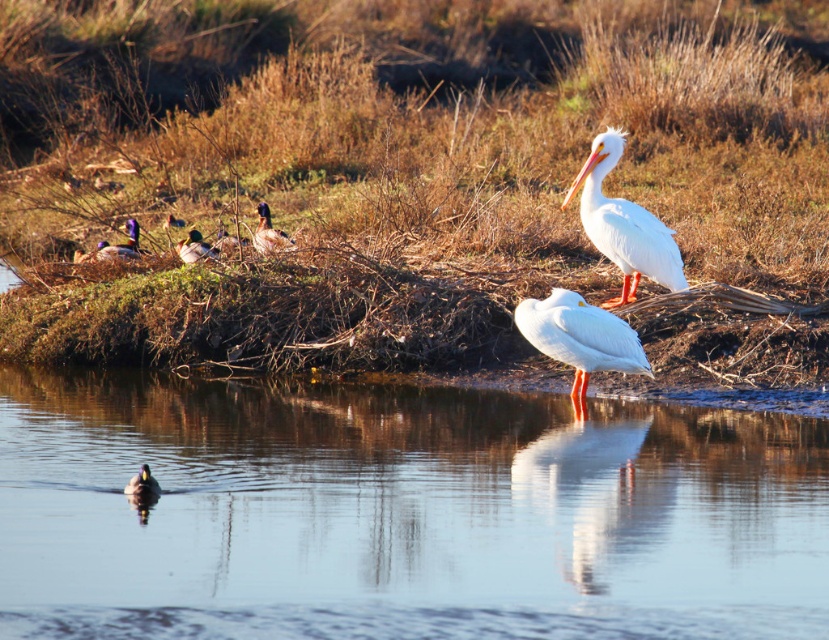
Question: Among these objects, which one is farthest from the camera?

Choices:
 (A) brown speckled duck at upper left
 (B) white smooth pelican at center
 (C) brown speckled feathers at upper left

Answer: (A)

Question: Which object appears closest to the camera in this image?

Choices:
 (A) green glossy duck at upper center
 (B) clear water at center

Answer: (B)

Question: Which point appears farthest from the camera in this image?

Choices:
 (A) (255, 228)
 (B) (191, 228)
 (C) (154, 490)
 (D) (163, 227)

Answer: (D)

Question: Can you confirm if white smooth pelican at upper right is thinner than brown glossy duck at lower left?

Choices:
 (A) yes
 (B) no

Answer: (B)

Question: Can you confirm if brown speckled feathers at center is positioned above brown speckled duck at upper left?

Choices:
 (A) yes
 (B) no

Answer: (B)

Question: From the image, what is the correct spatial relationship of clear water at center in relation to brown glossy duck at lower left?

Choices:
 (A) above
 (B) below

Answer: (B)